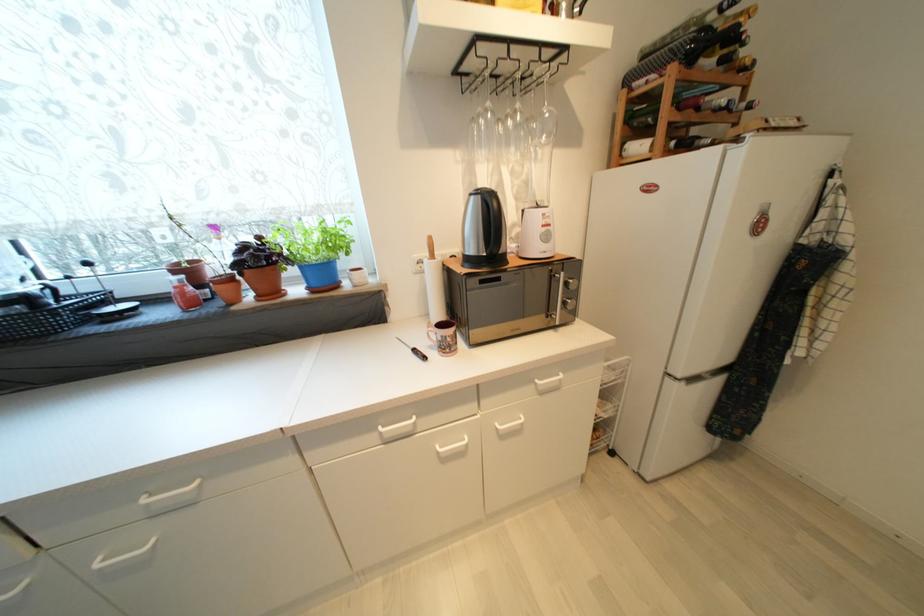
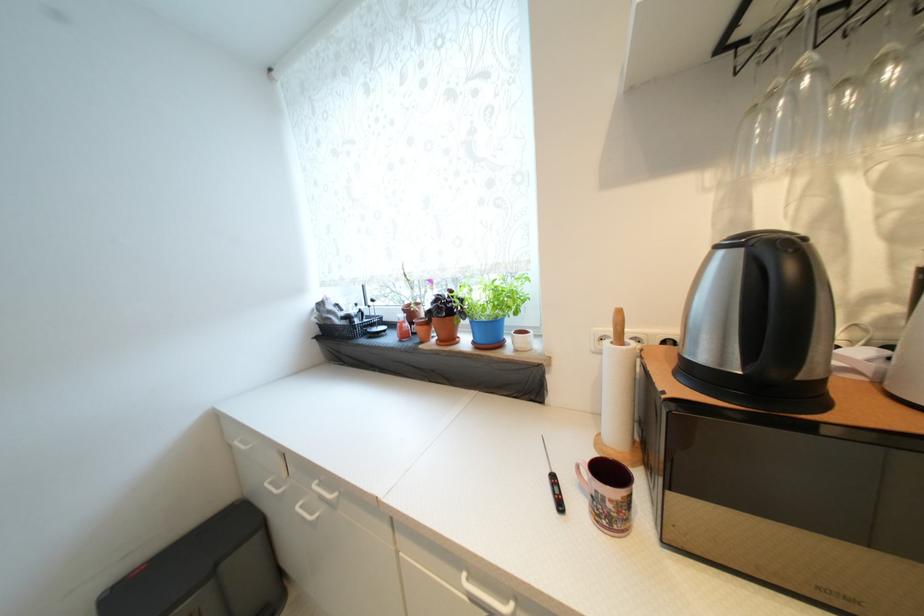
Where in the second image is the point corresponding to pixel 264 299 from the first image?

(445, 342)